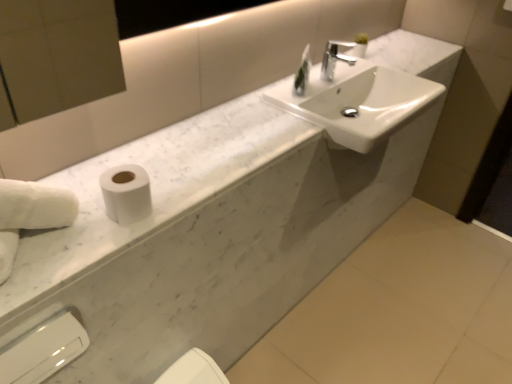
Question: Considering the relative sizes of clear glass soap dispenser at upper center and white fluffy hand towel at left in the image provided, is clear glass soap dispenser at upper center shorter than white fluffy hand towel at left?

Choices:
 (A) yes
 (B) no

Answer: (A)

Question: Is clear glass soap dispenser at upper center to the right of white fluffy hand towel at left from the viewer's perspective?

Choices:
 (A) no
 (B) yes

Answer: (B)

Question: Considering the relative sizes of clear glass soap dispenser at upper center and white fluffy hand towel at left in the image provided, is clear glass soap dispenser at upper center smaller than white fluffy hand towel at left?

Choices:
 (A) yes
 (B) no

Answer: (A)

Question: Is clear glass soap dispenser at upper center at the left side of white fluffy hand towel at left?

Choices:
 (A) no
 (B) yes

Answer: (A)

Question: Is clear glass soap dispenser at upper center in front of white fluffy hand towel at left?

Choices:
 (A) no
 (B) yes

Answer: (A)

Question: Considering the positions of white marble counter top at center and white matte toilet paper at left in the image, is white marble counter top at center wider or thinner than white matte toilet paper at left?

Choices:
 (A) thin
 (B) wide

Answer: (B)

Question: Based on their sizes in the image, would you say white marble counter top at center is bigger or smaller than white matte toilet paper at left?

Choices:
 (A) big
 (B) small

Answer: (A)

Question: Is point (96, 178) closer or farther from the camera than point (116, 188)?

Choices:
 (A) closer
 (B) farther

Answer: (B)

Question: Would you say white marble counter top at center is to the left or to the right of white matte toilet paper at left in the picture?

Choices:
 (A) right
 (B) left

Answer: (A)

Question: From the image's perspective, is white glossy bidet at lower center located above or below white marble counter top at center?

Choices:
 (A) above
 (B) below

Answer: (B)

Question: Considering the positions of point (192, 359) and point (156, 188), is point (192, 359) closer or farther from the camera than point (156, 188)?

Choices:
 (A) farther
 (B) closer

Answer: (A)

Question: In terms of height, does white glossy bidet at lower center look taller or shorter compared to white marble counter top at center?

Choices:
 (A) short
 (B) tall

Answer: (B)

Question: Looking at their shapes, would you say white glossy bidet at lower center is wider or thinner than white marble counter top at center?

Choices:
 (A) wide
 (B) thin

Answer: (B)

Question: From a real-world perspective, is white matte toilet paper at left positioned above or below white fluffy hand towel at left?

Choices:
 (A) above
 (B) below

Answer: (B)

Question: From the image's perspective, is white matte toilet paper at left located above or below white fluffy hand towel at left?

Choices:
 (A) below
 (B) above

Answer: (B)